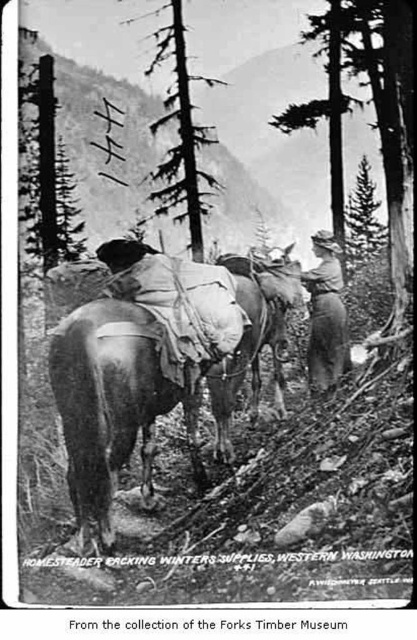
Based on the coordinates provided, which object in the scene is located at point (x=180, y=134)?

The point (x=180, y=134) corresponds to the smooth bark tree at center.

You are an observer in the scene and need to pack your supplies. Which item, the brown leather saddle at center or the brown leather hat at center, is shorter in height?

The brown leather saddle at center is not as tall as the brown leather hat at center, so the saddle is shorter in height.